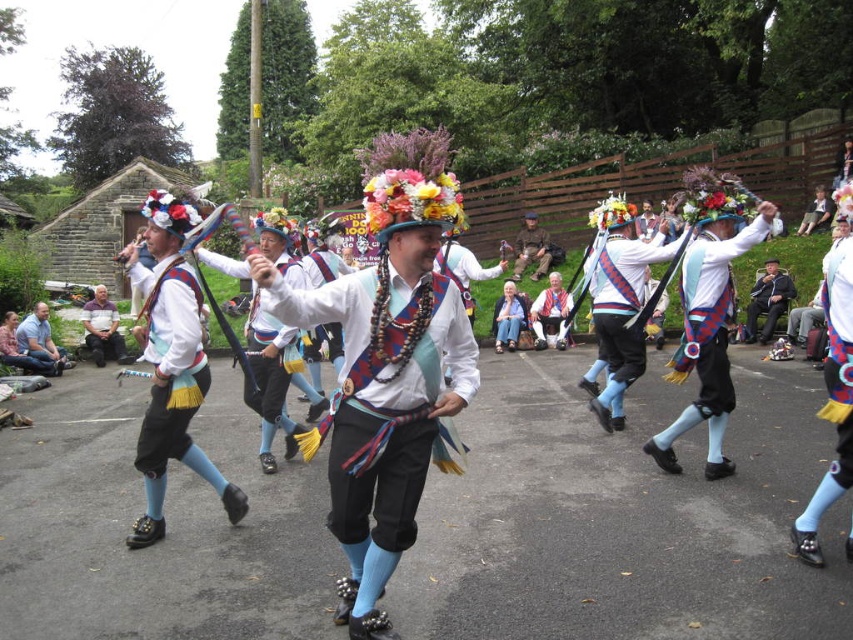
Who is lower down, dark blue fabric hat at center or brown fabric jacket at center?

Positioned lower is dark blue fabric hat at center.

Which is more to the right, dark blue fabric hat at center or brown fabric jacket at center?

dark blue fabric hat at center

Who is more distant from viewer, (776,280) or (521,243)?

The point (521,243) is more distant.

In order to click on dark blue fabric hat at center in this screenshot , I will do `click(767, 301)`.

Is point (154, 269) farther from viewer compared to point (103, 362)?

No.

Which is behind, point (177, 403) or point (102, 356)?

Point (102, 356)

The image size is (853, 640). In order to click on matte black pants at left in this screenshot , I will do `click(171, 364)`.

Is matte black pants at left wider than brown fabric jacket at center?

No.

Can you confirm if matte black pants at left is shorter than brown fabric jacket at center?

Incorrect, matte black pants at left's height does not fall short of brown fabric jacket at center's.

Between point (157, 294) and point (527, 260), which one is positioned in front?

Point (157, 294) is in front.

Image resolution: width=853 pixels, height=640 pixels. I want to click on matte black pants at left, so click(171, 364).